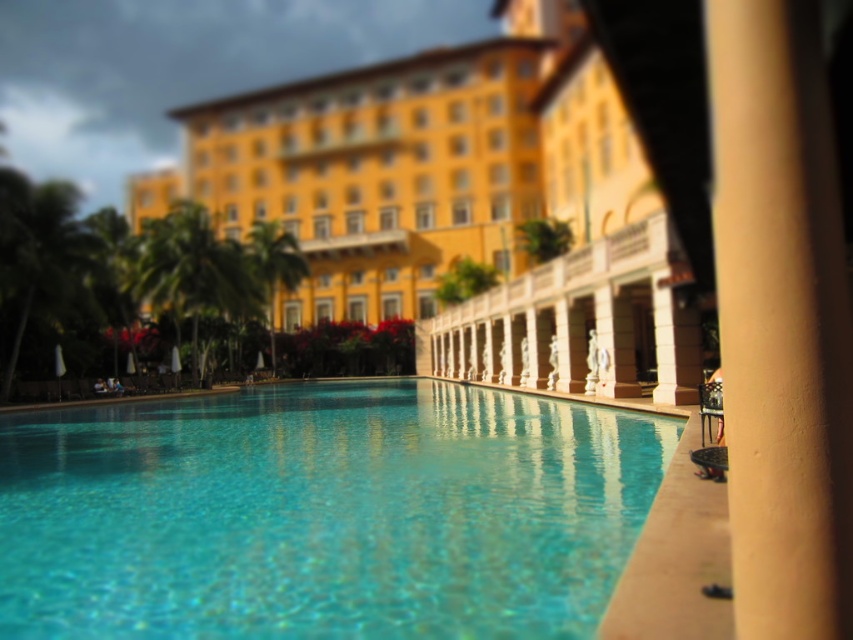
Question: Which point is closer to the camera taking this photo?

Choices:
 (A) [x=636, y=468]
 (B) [x=813, y=17]
 (C) [x=287, y=241]
 (D) [x=238, y=260]

Answer: (B)

Question: Does yellow matte building at center have a larger size compared to green leafy palm tree at left?

Choices:
 (A) no
 (B) yes

Answer: (B)

Question: Among these points, which one is nearest to the camera?

Choices:
 (A) (323, 276)
 (B) (502, 605)
 (C) (265, 317)

Answer: (B)

Question: Considering the relative positions of clear glass pool at center and green leafy palm tree at left in the image provided, where is clear glass pool at center located with respect to green leafy palm tree at left?

Choices:
 (A) above
 (B) below

Answer: (B)

Question: Among these points, which one is farthest from the camera?

Choices:
 (A) (732, 266)
 (B) (496, 109)
 (C) (149, 224)

Answer: (B)

Question: Is beige smooth pillar at center behind green leafy palm tree at center?

Choices:
 (A) no
 (B) yes

Answer: (A)